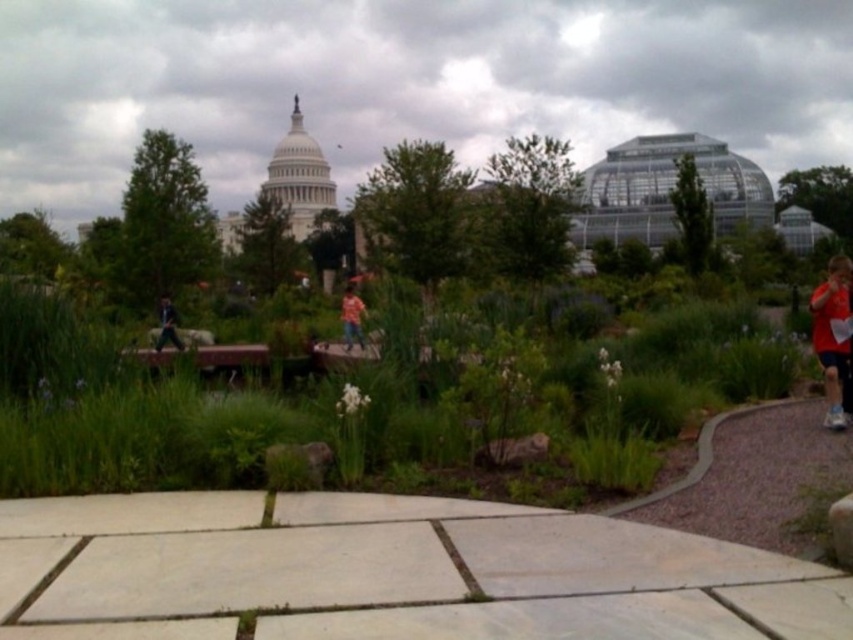
You are standing at the point with coordinates point (x=161, y=332) and want to walk towards the point with coordinates point (x=344, y=320). Given that the path is clear, will you be moving towards the camera or away from it?

Since point (x=344, y=320) is further to the camera than point (x=161, y=332), moving from point (x=161, y=332) to point (x=344, y=320) would mean you are moving towards the camera.

You are standing on the paved walkway and want to find the green grassy area at center. According to the scene, where should you look relative to the black fabric jacket at lower left?

The green grassy area at center is located below the black fabric jacket at lower left, so you should look downward from the black fabric jacket at lower left to find it.